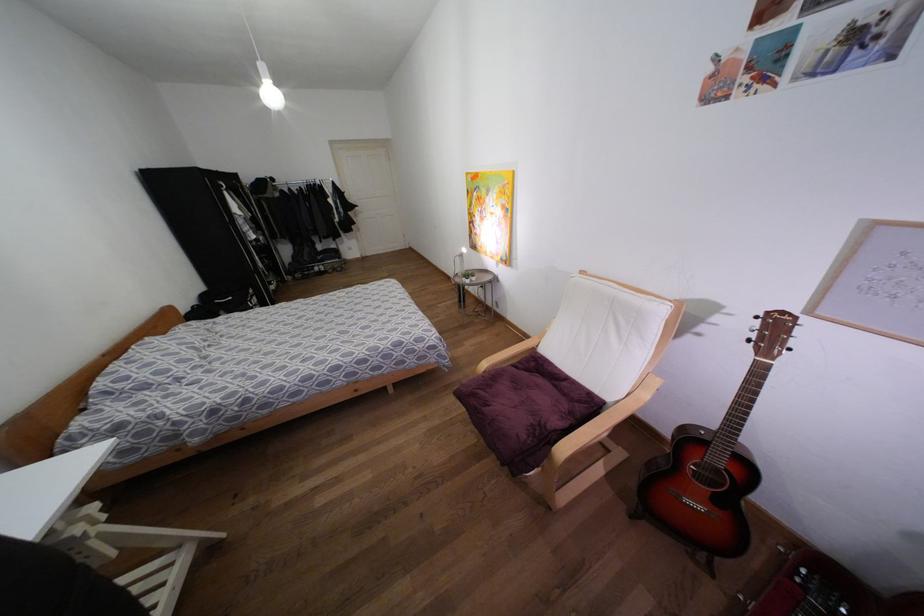
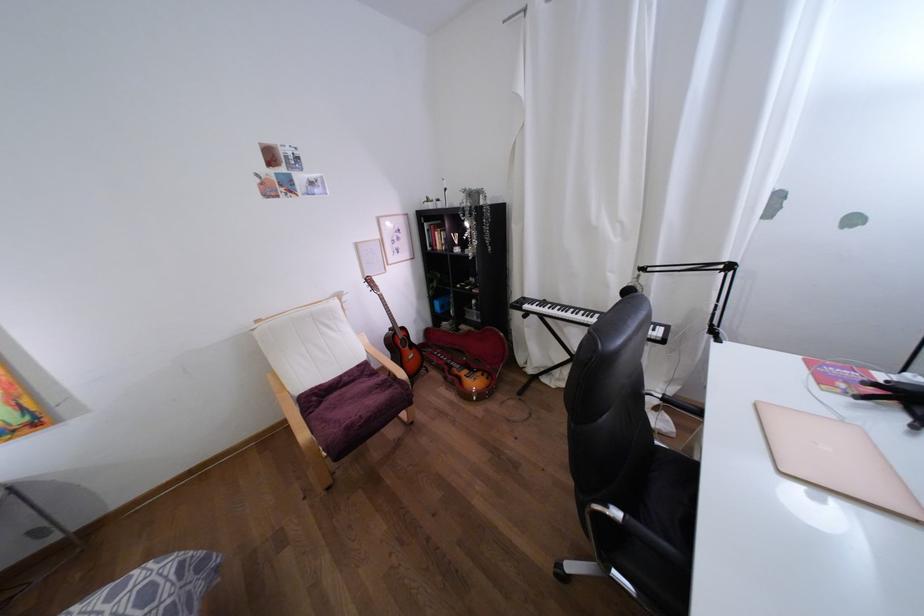
In the second image, find the point that corresponds to pixel 565 378 in the first image.

(339, 377)